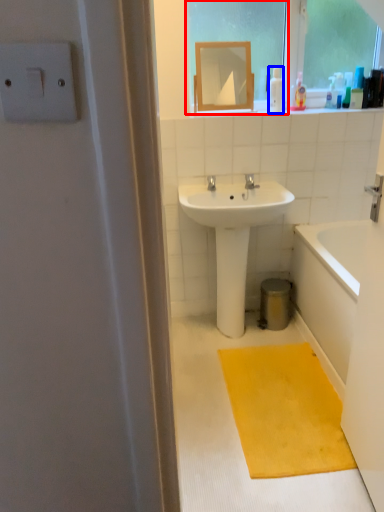
Question: Which object appears closest to the camera in this image, window screen (highlighted by a red box) or toiletry (highlighted by a blue box)?

Choices:
 (A) window screen
 (B) toiletry

Answer: (A)